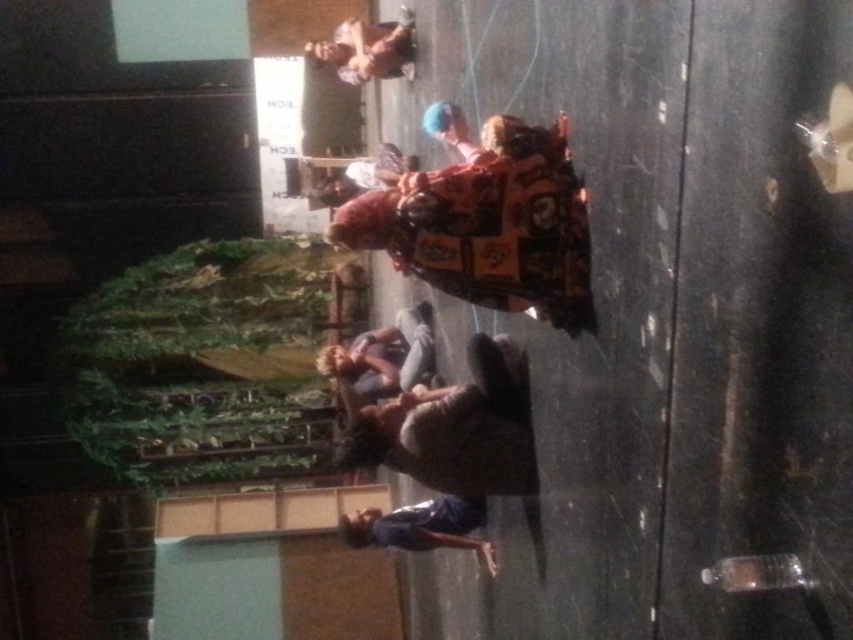
Question: Observing the image, what is the correct spatial positioning of dark blue jersey at lower center in reference to matte plastic doll at upper center?

Choices:
 (A) right
 (B) left

Answer: (A)

Question: Considering the real-world distances, which object is farthest from the matte plastic doll at upper center?

Choices:
 (A) matte gray skateboard at center
 (B) dark blue jersey at lower center

Answer: (B)

Question: Does dark blue jersey at lower center have a smaller size compared to matte plastic doll at upper center?

Choices:
 (A) yes
 (B) no

Answer: (A)

Question: Which is farther from the matte plastic doll at upper center?

Choices:
 (A) matte gray skateboard at center
 (B) dark blue jersey at lower center

Answer: (B)

Question: Based on their relative distances, which object is farther from the dark blue jersey at lower center?

Choices:
 (A) matte plastic doll at upper center
 (B) matte gray skateboard at center

Answer: (A)

Question: Where is matte gray skateboard at center located in relation to dark blue jersey at lower center in the image?

Choices:
 (A) left
 (B) right

Answer: (B)